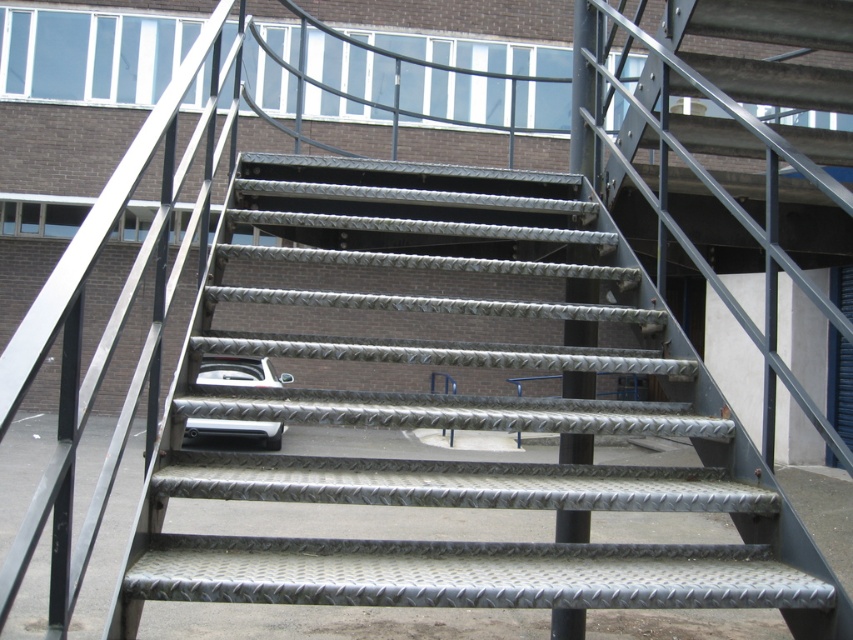
Question: Is the position of metallic textured stairs at center less distant than that of metallic silver car at center?

Choices:
 (A) yes
 (B) no

Answer: (A)

Question: Is metallic textured stairs at center to the left of metallic silver car at center from the viewer's perspective?

Choices:
 (A) yes
 (B) no

Answer: (B)

Question: Is metallic textured stairs at center below metallic silver car at center?

Choices:
 (A) yes
 (B) no

Answer: (B)

Question: Among these objects, which one is nearest to the camera?

Choices:
 (A) metallic textured stairs at center
 (B) metallic silver car at center

Answer: (A)

Question: Which object appears closest to the camera in this image?

Choices:
 (A) metallic textured stairs at center
 (B) metallic silver car at center

Answer: (A)